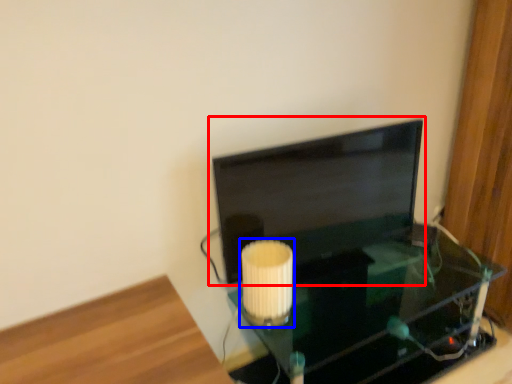
Question: Among these objects, which one is nearest to the camera, computer monitor (highlighted by a red box) or lamp (highlighted by a blue box)?

Choices:
 (A) computer monitor
 (B) lamp

Answer: (B)